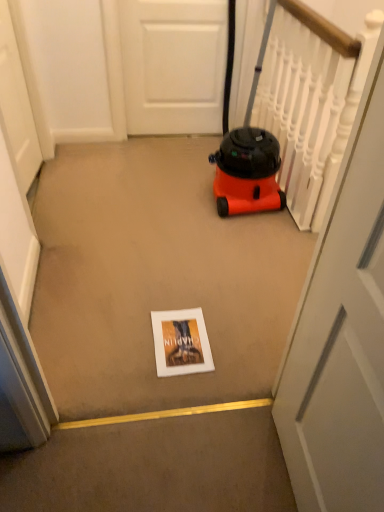
Question: Should I look upward or downward to see matte white book at center?

Choices:
 (A) up
 (B) down

Answer: (B)

Question: Is the surface of white matte door at upper center, the 3th door viewed from the front, in direct contact with white matte door at left, positioned as the 3th door in right-to-left order?

Choices:
 (A) yes
 (B) no

Answer: (B)

Question: Does white matte door at upper center, marked as the 2th door in a right-to-left arrangement, have a lesser width compared to white matte door at left, the second door in the back-to-front sequence?

Choices:
 (A) no
 (B) yes

Answer: (B)

Question: From the image's perspective, is white matte door at upper center, the second door positioned from the left, located beneath white matte door at left, the second door in the back-to-front sequence?

Choices:
 (A) yes
 (B) no

Answer: (B)

Question: Can you confirm if white matte door at upper center, marked as the 2th door in a right-to-left arrangement, is wider than white matte door at left, the second door in the back-to-front sequence?

Choices:
 (A) yes
 (B) no

Answer: (B)

Question: Would you consider white matte door at upper center, marked as the 2th door in a right-to-left arrangement, to be distant from white matte door at left, which is the second door in front-to-back order?

Choices:
 (A) yes
 (B) no

Answer: (B)

Question: From a real-world perspective, is white matte door at upper center, the first door viewed from the back, physically above white matte door at left, the second door in the back-to-front sequence?

Choices:
 (A) no
 (B) yes

Answer: (B)

Question: Is white matte door at left, the first door from the left, at the back of white glossy door at center, arranged as the 1th door when viewed from the right?

Choices:
 (A) yes
 (B) no

Answer: (B)

Question: Is white glossy door at center, which is the third door from back to front, located outside white matte door at left, the first door from the left?

Choices:
 (A) yes
 (B) no

Answer: (A)

Question: Can you confirm if white glossy door at center, arranged as the 1th door when viewed from the right, is positioned to the left of white matte door at left, positioned as the 3th door in right-to-left order?

Choices:
 (A) yes
 (B) no

Answer: (B)

Question: Is white glossy door at center, which is the third door from back to front, with white matte door at left, which is the second door in front-to-back order?

Choices:
 (A) yes
 (B) no

Answer: (B)

Question: From the image's perspective, is white glossy door at center, marked as the first door in a front-to-back arrangement, located above white matte door at left, which is the second door in front-to-back order?

Choices:
 (A) no
 (B) yes

Answer: (A)

Question: Does white glossy door at center, which is counted as the third door, starting from the left, have a lesser height compared to white matte door at left, which is the second door in front-to-back order?

Choices:
 (A) no
 (B) yes

Answer: (A)

Question: Does white matte door at left, the first door from the left, have a greater width compared to matte white book at center?

Choices:
 (A) no
 (B) yes

Answer: (A)